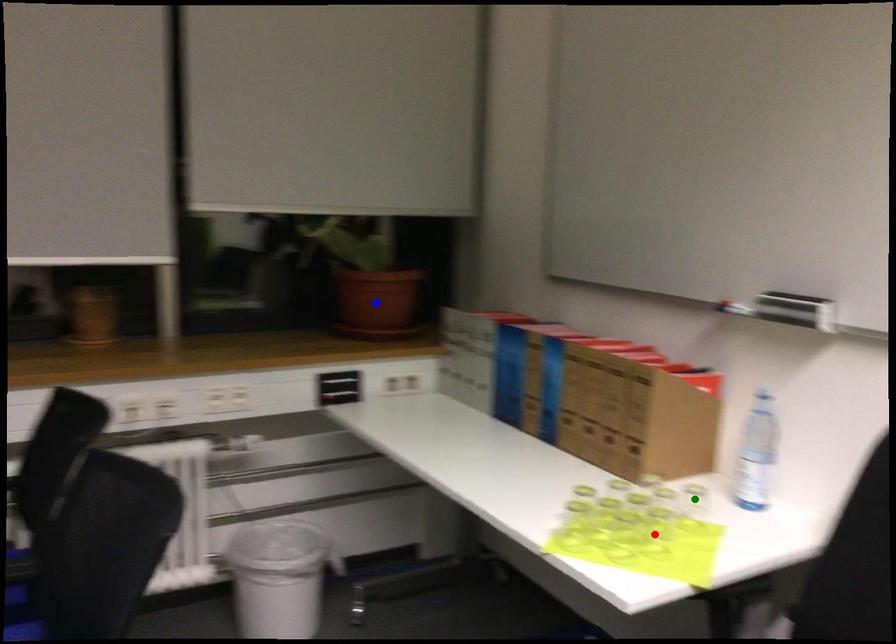
Order these from nearest to farthest:
- red point
- green point
- blue point

red point → green point → blue point